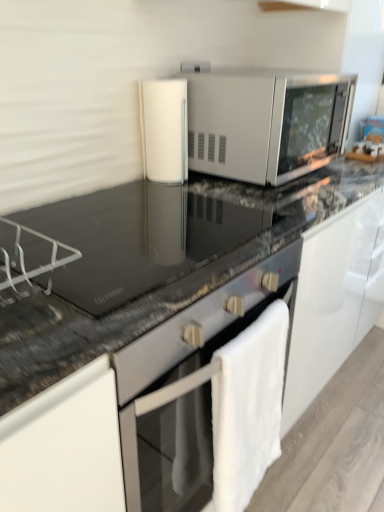
Question: Considering the positions of white fluffy bath towel at lower right and satin silver microwave at center in the image, is white fluffy bath towel at lower right bigger or smaller than satin silver microwave at center?

Choices:
 (A) small
 (B) big

Answer: (A)

Question: Considering their positions, is white fluffy bath towel at lower right located in front of or behind satin silver microwave at center?

Choices:
 (A) behind
 (B) front

Answer: (B)

Question: Estimate the real-world distances between objects in this image. Which object is farther from the black granite countertop at center, which is counted as the first countertop, starting from the bottom?

Choices:
 (A) white glossy cylindrical container at center
 (B) white fluffy bath towel at lower right
 (C) satin silver microwave at center
 (D) black glass countertop at center, the first countertop when ordered from top to bottom

Answer: (A)

Question: Which is nearer to the satin silver microwave at center?

Choices:
 (A) black granite countertop at center, which is counted as the first countertop, starting from the bottom
 (B) white fluffy bath towel at lower right
 (C) white glossy cylindrical container at center
 (D) black glass countertop at center, which is counted as the 2th countertop, starting from the bottom

Answer: (C)